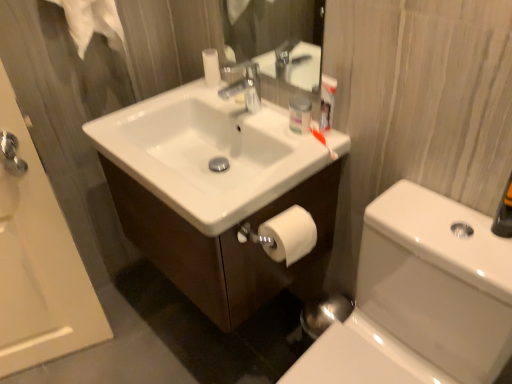
Question: From the image's perspective, is white glossy bathtub at upper left positioned above or below white matte toilet paper at lower right?

Choices:
 (A) below
 (B) above

Answer: (A)

Question: From a real-world perspective, is white glossy bathtub at upper left positioned above or below white matte toilet paper at lower right?

Choices:
 (A) above
 (B) below

Answer: (B)

Question: Which object is the closest to the matte plastic container at upper center?

Choices:
 (A) white glossy bathtub at upper left
 (B) white glossy cabinet at center
 (C) white glossy sink at center
 (D) white glossy toilet bowl at lower right
 (E) white matte toilet paper at lower right

Answer: (C)

Question: Which object is the closest to the white glossy bathtub at upper left?

Choices:
 (A) white matte toilet paper at lower right
 (B) white glossy toilet bowl at lower right
 (C) matte plastic container at upper center
 (D) white glossy sink at center
 (E) white glossy cabinet at center

Answer: (E)